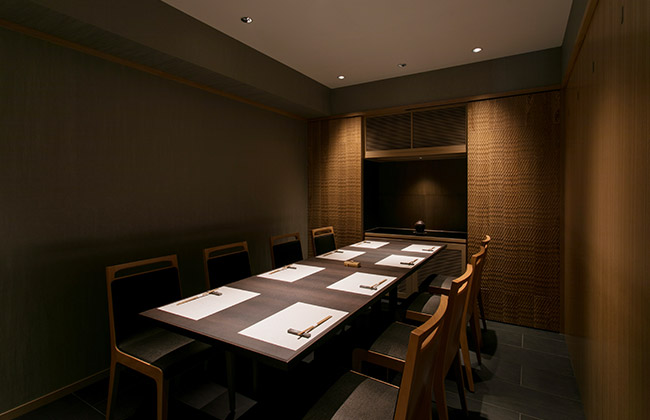
Where is `overhead ceiling light`? The image size is (650, 420). overhead ceiling light is located at coordinates (340, 75).